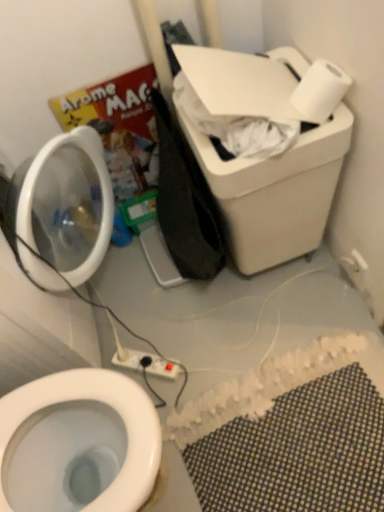
Question: Looking at their shapes, would you say white matte toilet paper at upper right is wider or thinner than white mesh bath mat at lower right?

Choices:
 (A) thin
 (B) wide

Answer: (A)

Question: Is white matte toilet paper at upper right bigger or smaller than white mesh bath mat at lower right?

Choices:
 (A) big
 (B) small

Answer: (B)

Question: Which is farther from the white mesh bath mat at lower right?

Choices:
 (A) white plastic electric outlet at upper right, the first electric outlet in the right-to-left sequence
 (B) white matte toilet paper at upper right
 (C) translucent plastic container at left
 (D) white plastic power strip at lower center, acting as the 2th electric outlet starting from the top

Answer: (B)

Question: Based on their relative distances, which object is farther from the white plastic electric outlet at upper right, placed as the first electric outlet when sorted from top to bottom?

Choices:
 (A) white mesh bath mat at lower right
 (B) translucent plastic container at left
 (C) white matte toilet paper at upper right
 (D) white plastic power strip at lower center, acting as the 2th electric outlet starting from the top

Answer: (B)